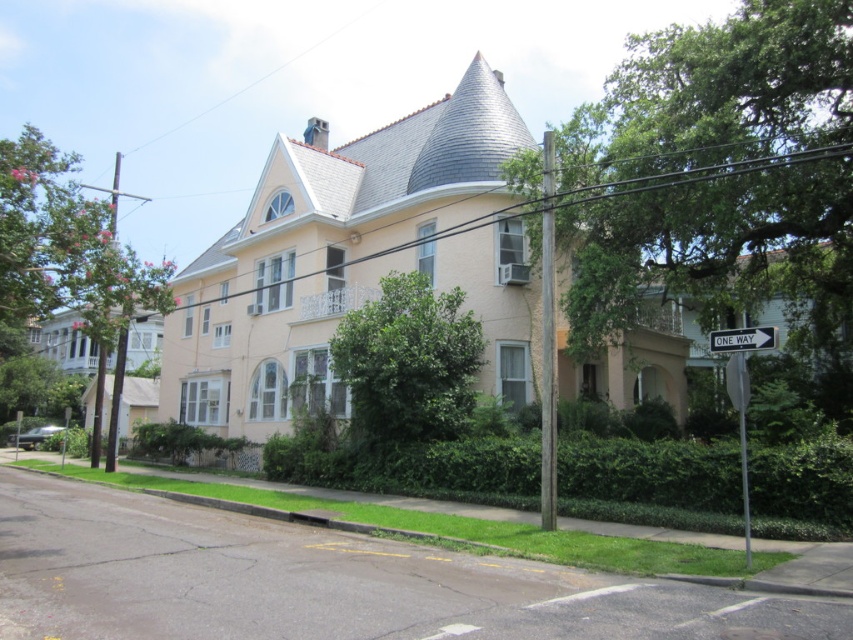
Question: Which point is farther to the camera?

Choices:
 (A) (12, 205)
 (B) (428, 374)
 (C) (828, 1)
 (D) (579, 468)

Answer: (B)

Question: Which of the following is the farthest from the observer?

Choices:
 (A) white plastic sign at center right
 (B) pink textured tree at left

Answer: (B)

Question: Which of these objects is positioned closest to the green leafy hedge at lower center?

Choices:
 (A) pink textured tree at left
 (B) green leafy tree at upper center
 (C) green leafy tree at center

Answer: (C)

Question: Does green leafy hedge at lower center have a smaller size compared to pink textured tree at left?

Choices:
 (A) yes
 (B) no

Answer: (A)

Question: Can you confirm if green leafy hedge at lower center is positioned to the right of pink textured tree at left?

Choices:
 (A) yes
 (B) no

Answer: (A)

Question: In this image, where is green leafy tree at upper center located relative to white plastic sign at center right?

Choices:
 (A) above
 (B) below

Answer: (A)